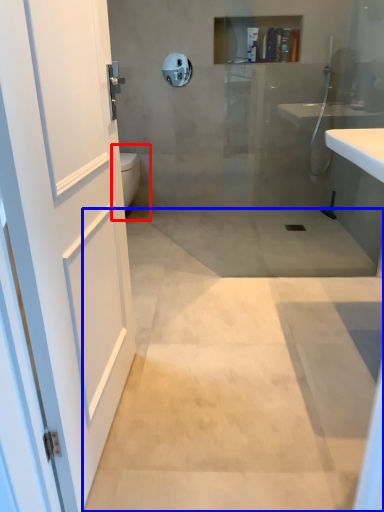
Question: Which object appears farthest to the camera in this image, toilet bowl (highlighted by a red box) or concrete (highlighted by a blue box)?

Choices:
 (A) toilet bowl
 (B) concrete

Answer: (A)